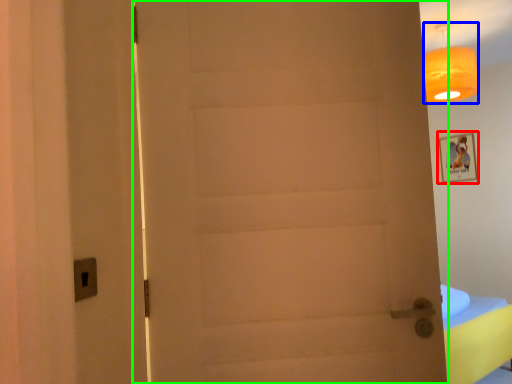
Question: Which is farther away from picture frame (highlighted by a red box)? lamp (highlighted by a blue box) or door (highlighted by a green box)?

Choices:
 (A) lamp
 (B) door

Answer: (B)